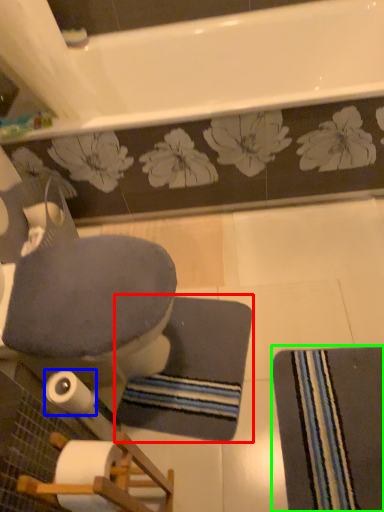
Question: Which object is the closest to the bath mat (highlighted by a red box)? Choose among these: toilet paper (highlighted by a blue box) or doormat (highlighted by a green box).

Choices:
 (A) toilet paper
 (B) doormat

Answer: (B)